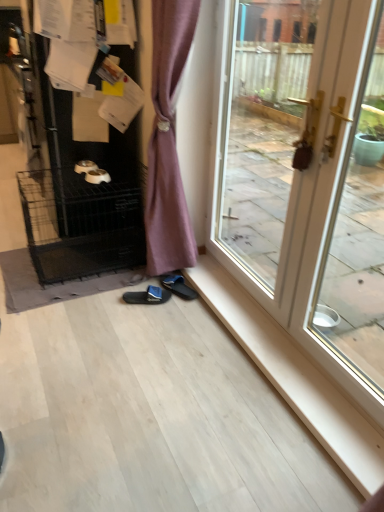
Question: From a real-world perspective, is black wire dog crate at left physically located above or below black wire cage at left?

Choices:
 (A) below
 (B) above

Answer: (B)

Question: Is black wire dog crate at left taller or shorter than black wire cage at left?

Choices:
 (A) tall
 (B) short

Answer: (A)

Question: Estimate the real-world distances between objects in this image. Which object is closer to the white glossy door at right?

Choices:
 (A) black fabric slipper at lower center, the 2th footwear in the right-to-left sequence
 (B) black fabric slipper at lower center, which is the first footwear in right-to-left order
 (C) black wire cage at left
 (D) black wire dog crate at left
 (E) white glossy screen door at right

Answer: (E)

Question: Which is farther from the black wire dog crate at left?

Choices:
 (A) black wire cage at left
 (B) white glossy door at right
 (C) black fabric slipper at lower center, which appears as the 2th footwear when viewed from the left
 (D) white glossy screen door at right
 (E) black fabric slipper at lower center, which is counted as the 1th footwear, starting from the left

Answer: (D)